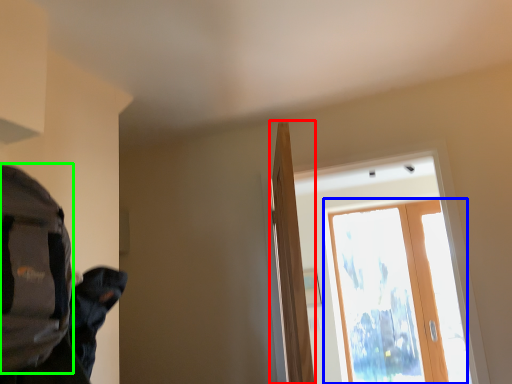
Question: Which object is the closest to the door (highlighted by a red box)? Choose among these: screen door (highlighted by a blue box) or backpack (highlighted by a green box).

Choices:
 (A) screen door
 (B) backpack

Answer: (B)